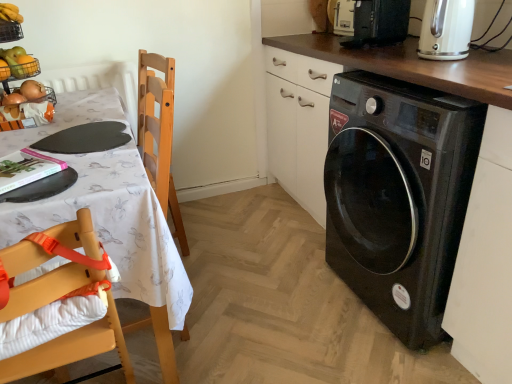
Question: From the image's perspective, does metallic wire basket at upper left appear higher than black glossy washing machine at lower right?

Choices:
 (A) yes
 (B) no

Answer: (A)

Question: Is black glossy washing machine at lower right located within metallic wire basket at upper left?

Choices:
 (A) yes
 (B) no

Answer: (B)

Question: Is metallic wire basket at upper left positioned far away from black glossy washing machine at lower right?

Choices:
 (A) yes
 (B) no

Answer: (A)

Question: Does metallic wire basket at upper left have a lesser height compared to black glossy washing machine at lower right?

Choices:
 (A) no
 (B) yes

Answer: (B)

Question: Is metallic wire basket at upper left placed right next to black glossy washing machine at lower right?

Choices:
 (A) no
 (B) yes

Answer: (A)

Question: Is metallic wire basket at upper left thinner than black glossy washing machine at lower right?

Choices:
 (A) no
 (B) yes

Answer: (B)

Question: From a real-world perspective, is wooden highchair at left on top of metallic wire basket at upper left?

Choices:
 (A) yes
 (B) no

Answer: (B)

Question: From a real-world perspective, is wooden highchair at left located beneath metallic wire basket at upper left?

Choices:
 (A) yes
 (B) no

Answer: (A)

Question: Can you confirm if wooden highchair at left is positioned to the right of metallic wire basket at upper left?

Choices:
 (A) yes
 (B) no

Answer: (A)

Question: Is wooden highchair at left turned away from metallic wire basket at upper left?

Choices:
 (A) yes
 (B) no

Answer: (B)

Question: Is wooden highchair at left next to metallic wire basket at upper left and touching it?

Choices:
 (A) no
 (B) yes

Answer: (A)

Question: From the image's perspective, would you say wooden highchair at left is shown under metallic wire basket at upper left?

Choices:
 (A) yes
 (B) no

Answer: (A)

Question: Is wooden highchair at left shorter than black glossy washing machine at lower right?

Choices:
 (A) yes
 (B) no

Answer: (A)